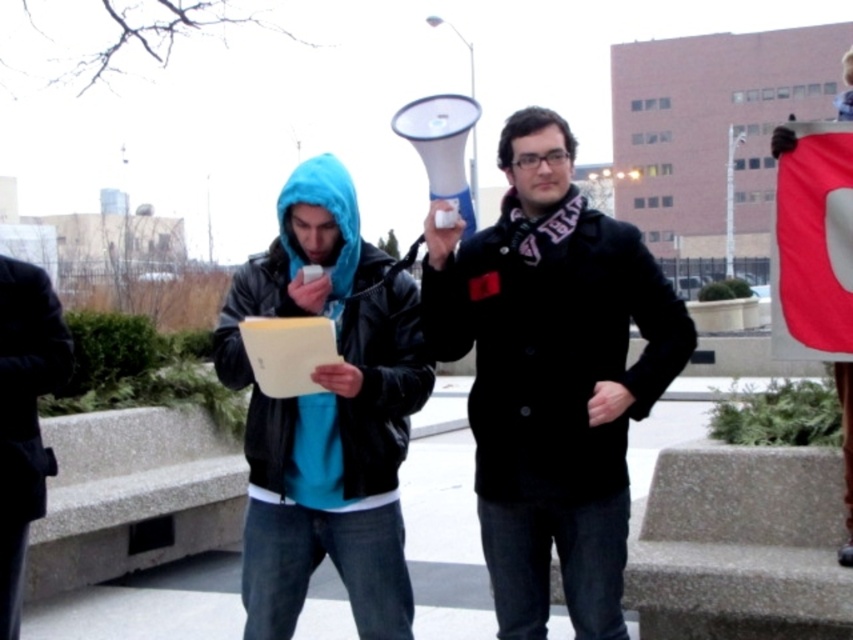
Question: Among these points, which one is farthest from the camera?

Choices:
 (A) (44, 381)
 (B) (611, 544)

Answer: (A)

Question: Which object appears farthest from the camera in this image?

Choices:
 (A) black leather jacket at left
 (B) black wool coat at center

Answer: (B)

Question: Can you confirm if black wool coat at center is smaller than black leather jacket at left?

Choices:
 (A) yes
 (B) no

Answer: (A)

Question: Does black wool coat at center have a smaller size compared to black leather jacket at left?

Choices:
 (A) yes
 (B) no

Answer: (A)

Question: Which of the following is the closest to the observer?

Choices:
 (A) (579, 317)
 (B) (0, 630)

Answer: (B)

Question: Is black wool coat at center to the right of black leather jacket at left from the viewer's perspective?

Choices:
 (A) no
 (B) yes

Answer: (B)